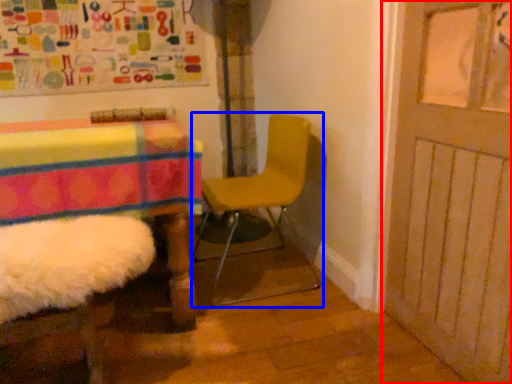
Question: Which object appears closest to the camera in this image, door (highlighted by a red box) or chair (highlighted by a blue box)?

Choices:
 (A) door
 (B) chair

Answer: (A)